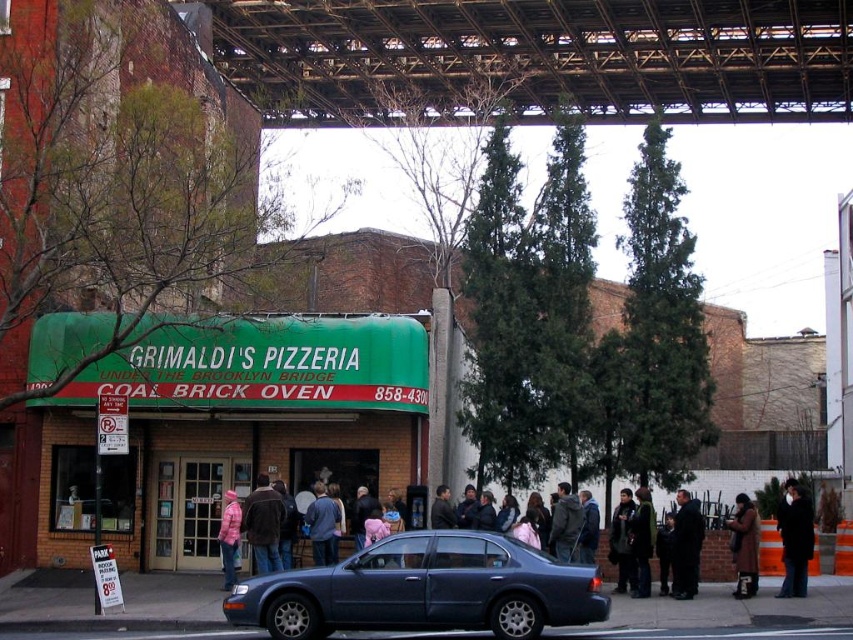
Question: Is brown wool coat at lower right positioned before pink wool jacket at center?

Choices:
 (A) no
 (B) yes

Answer: (B)

Question: Estimate the real-world distances between objects in this image. Which object is closer to the dark blue car at center?

Choices:
 (A) dark brown leather jacket at center
 (B) brown leather jacket at center

Answer: (A)

Question: Among these objects, which one is farthest from the camera?

Choices:
 (A) brown leather jacket at center
 (B) black wool coat at lower right
 (C) black leather jacket at center
 (D) green matte sign at center

Answer: (D)

Question: Based on their relative distances, which object is nearer to the brown leather jacket at center?

Choices:
 (A) dark blue jacket at center
 (B) green matte sign at center

Answer: (B)

Question: Is green matte sign at center wider than metallic blue sedan at center?

Choices:
 (A) yes
 (B) no

Answer: (A)

Question: Does brown leather jacket at center appear under brown wool coat at lower right?

Choices:
 (A) no
 (B) yes

Answer: (A)